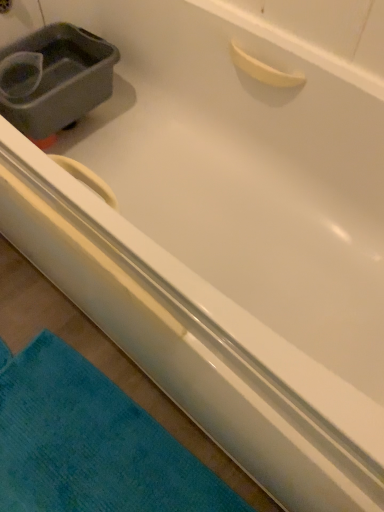
Question: In terms of width, does teal soft towel at lower left look wider or thinner when compared to gray plastic sink at upper left?

Choices:
 (A) thin
 (B) wide

Answer: (B)

Question: Is point (183, 463) closer or farther from the camera than point (14, 52)?

Choices:
 (A) closer
 (B) farther

Answer: (A)

Question: Considering the relative positions of teal soft towel at lower left and gray plastic sink at upper left in the image provided, is teal soft towel at lower left to the left or to the right of gray plastic sink at upper left?

Choices:
 (A) left
 (B) right

Answer: (B)

Question: From a real-world perspective, is gray plastic sink at upper left positioned above or below teal soft towel at lower left?

Choices:
 (A) above
 (B) below

Answer: (A)

Question: Is gray plastic sink at upper left to the left or to the right of teal soft towel at lower left in the image?

Choices:
 (A) left
 (B) right

Answer: (A)

Question: Considering the positions of gray plastic sink at upper left and teal soft towel at lower left in the image, is gray plastic sink at upper left bigger or smaller than teal soft towel at lower left?

Choices:
 (A) big
 (B) small

Answer: (A)

Question: Looking at their shapes, would you say gray plastic sink at upper left is wider or thinner than teal soft towel at lower left?

Choices:
 (A) wide
 (B) thin

Answer: (B)